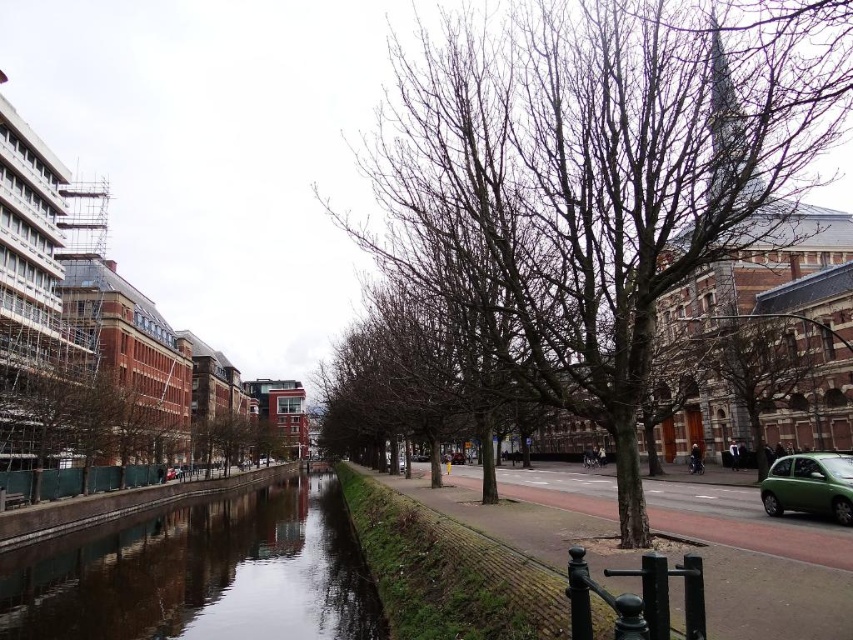
I want to click on bare branches at center, so click(x=587, y=182).

Can you confirm if bare branches at center is positioned below green matte car at lower right?

No.

You are a GUI agent. You are given a task and a screenshot of the screen. Output one action in this format:
    pyautogui.click(x=<x>, y=<y>)
    Task: Click on the bare branches at center
    The height and width of the screenshot is (640, 853).
    Given the screenshot: What is the action you would take?
    pyautogui.click(x=587, y=182)

I want to click on bare branches at center, so [587, 182].

Consider the image. Can you confirm if bare wood tree at center is positioned above green matte car at lower right?

Correct, bare wood tree at center is located above green matte car at lower right.

Between bare wood tree at center and green matte car at lower right, which one is positioned higher?

Positioned higher is bare wood tree at center.

Where is `bare wood tree at center`? Image resolution: width=853 pixels, height=640 pixels. bare wood tree at center is located at coordinates (756, 364).

The width and height of the screenshot is (853, 640). In order to click on bare wood tree at center in this screenshot , I will do `click(756, 364)`.

Is point (248, 588) less distant than point (743, 323)?

Yes, it is.

The height and width of the screenshot is (640, 853). What do you see at coordinates (202, 573) in the screenshot? I see `smooth concrete canal at center` at bounding box center [202, 573].

Locate an element on the screen. smooth concrete canal at center is located at coordinates (202, 573).